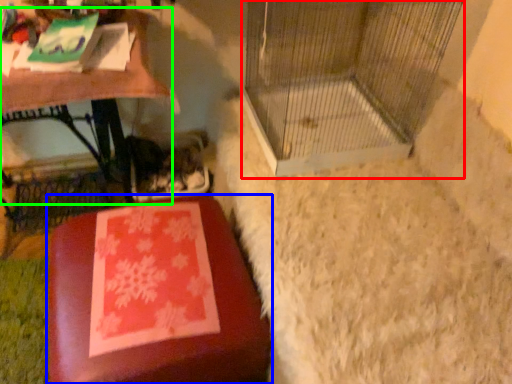
Question: Which object is positioned farthest from bird cage (highlighted by a red box)? Select from furniture (highlighted by a blue box) and table (highlighted by a green box).

Choices:
 (A) furniture
 (B) table

Answer: (A)